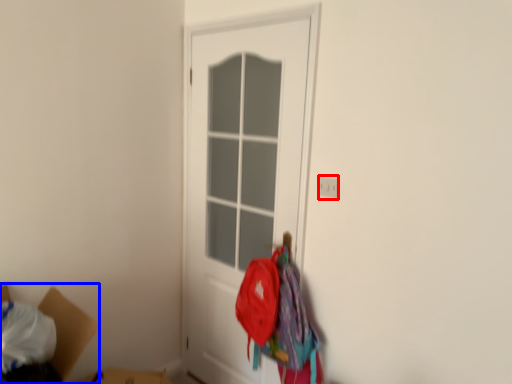
Question: Which of the following is the farthest to the observer, electric outlet (highlighted by a red box) or cardboard box (highlighted by a blue box)?

Choices:
 (A) electric outlet
 (B) cardboard box

Answer: (A)